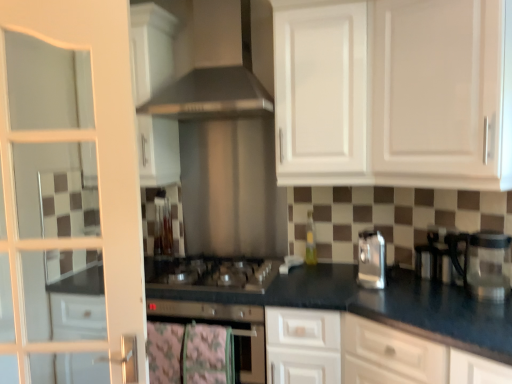
Question: Does black granite countertop at center have a greater width compared to satin silver oven at center?

Choices:
 (A) no
 (B) yes

Answer: (B)

Question: Is satin silver oven at center a part of black granite countertop at center?

Choices:
 (A) yes
 (B) no

Answer: (A)

Question: Is black granite countertop at center further to the viewer compared to satin silver oven at center?

Choices:
 (A) yes
 (B) no

Answer: (B)

Question: Can you confirm if black granite countertop at center is smaller than satin silver oven at center?

Choices:
 (A) yes
 (B) no

Answer: (B)

Question: Can you confirm if black granite countertop at center is positioned to the left of satin silver oven at center?

Choices:
 (A) no
 (B) yes

Answer: (A)

Question: Would you consider black granite countertop at center to be distant from satin silver oven at center?

Choices:
 (A) yes
 (B) no

Answer: (B)

Question: Is satin silver gas stove at center inside satin silver toaster at right?

Choices:
 (A) yes
 (B) no

Answer: (B)

Question: From a real-world perspective, does satin silver toaster at right sit lower than satin silver gas stove at center?

Choices:
 (A) yes
 (B) no

Answer: (B)

Question: Is satin silver toaster at right behind satin silver gas stove at center?

Choices:
 (A) yes
 (B) no

Answer: (B)

Question: Is satin silver toaster at right far away from satin silver gas stove at center?

Choices:
 (A) no
 (B) yes

Answer: (A)

Question: Is satin silver toaster at right closer to the viewer compared to satin silver gas stove at center?

Choices:
 (A) no
 (B) yes

Answer: (B)

Question: Could you tell me if satin silver toaster at right is facing satin silver gas stove at center?

Choices:
 (A) yes
 (B) no

Answer: (B)

Question: Is satin silver toaster at right shorter than white glossy cabinet at upper center, marked as the 2th cabinetry in a back-to-front arrangement?

Choices:
 (A) yes
 (B) no

Answer: (A)